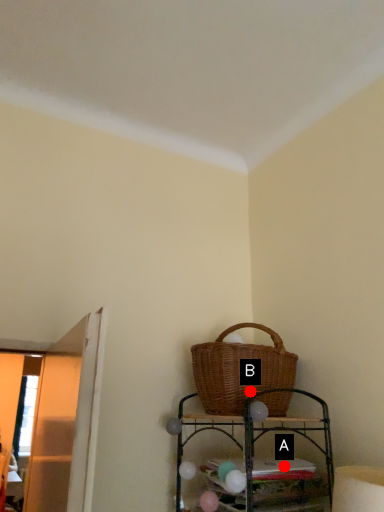
Question: Two points are circled on the image, labeled by A and B beside each circle. Which point is further to the camera?

Choices:
 (A) A is further
 (B) B is further

Answer: (B)